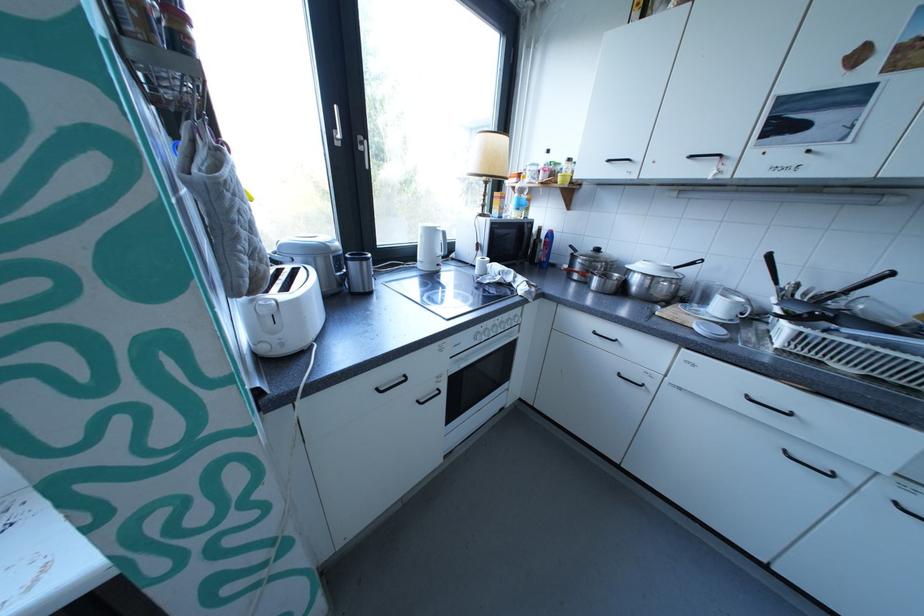
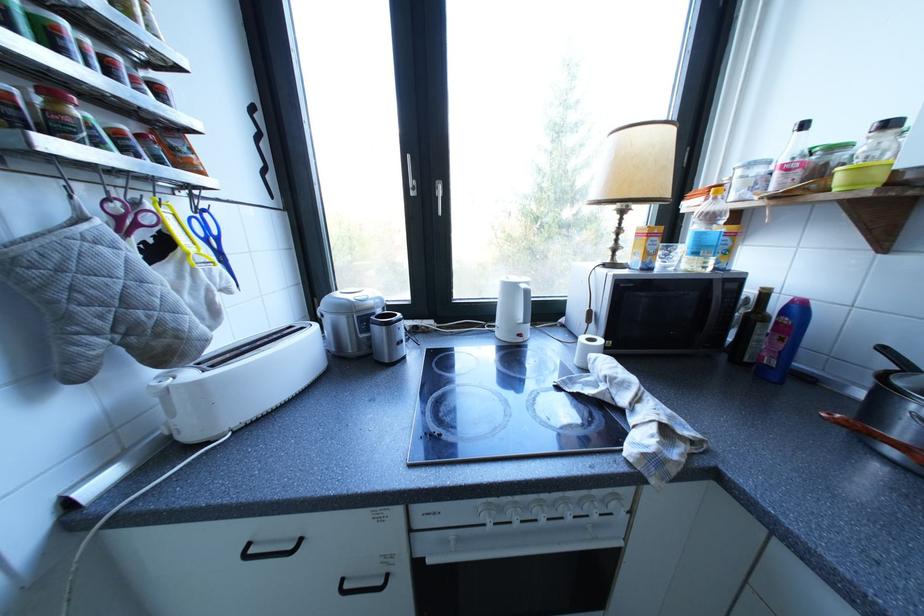
Where in the second image is the point corresponding to (309,301) from the first image?

(210, 384)